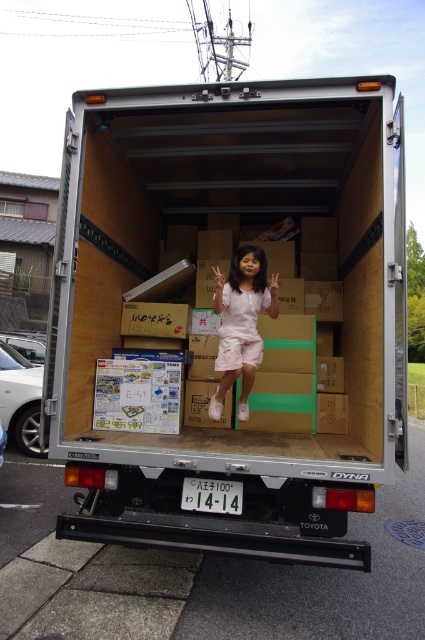
The white matte shorts at center are located at what coordinate point?

The white matte shorts at center are located at coordinate point (240, 323).

You are a delivery person checking the loading of the Toyota Dyna truck. You notice the silver metallic truck at center and the white matte shorts at center. Which object is taller?

The silver metallic truck at center is taller than the white matte shorts at center.

You are a delivery person checking the space inside the truck. You see the white matte shorts at center and the white plastic license plate at center. Which item takes up more horizontal space in the truck?

The white matte shorts at center might be wider than the white plastic license plate at center, so it likely takes up more horizontal space in the truck.